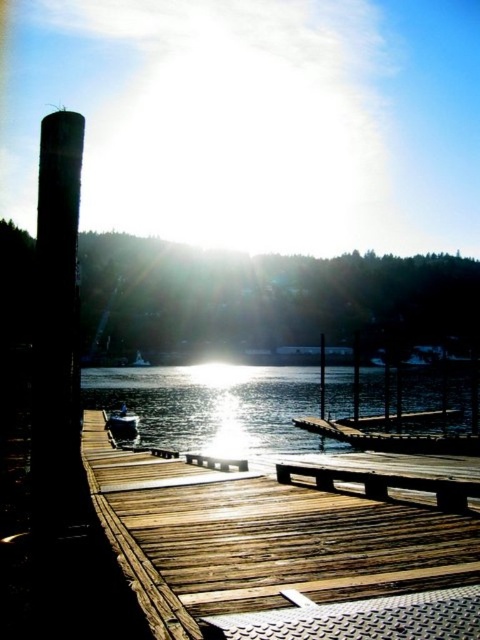
Who is more forward, (303,573) or (300,468)?

Point (303,573)

Can you confirm if wooden dock at center is positioned above wooden picnic table at center?

Yes, wooden dock at center is above wooden picnic table at center.

What do you see at coordinates (260, 538) in the screenshot? I see `wooden dock at center` at bounding box center [260, 538].

Image resolution: width=480 pixels, height=640 pixels. What are the coordinates of `wooden dock at center` in the screenshot? It's located at (260, 538).

Which is in front, point (311, 554) or point (296, 378)?

Point (311, 554) is in front.

Does point (195, 632) lie behind point (287, 403)?

No.

Locate an element on the screen. This screenshot has width=480, height=640. wooden dock at center is located at coordinates (260, 538).

Based on the photo, is wooden picnic table at center bigger than white glossy boat at center?

Indeed, wooden picnic table at center has a larger size compared to white glossy boat at center.

Who is taller, wooden picnic table at center or white glossy boat at center?

Standing taller between the two is wooden picnic table at center.

The image size is (480, 640). Identify the location of wooden picnic table at center. 386,483.

You are a GUI agent. You are given a task and a screenshot of the screen. Output one action in this format:
    pyautogui.click(x=<x>, y=<y>)
    Task: Click on the wooden picnic table at center
    Image resolution: width=480 pixels, height=640 pixels.
    Given the screenshot: What is the action you would take?
    pyautogui.click(x=386, y=483)